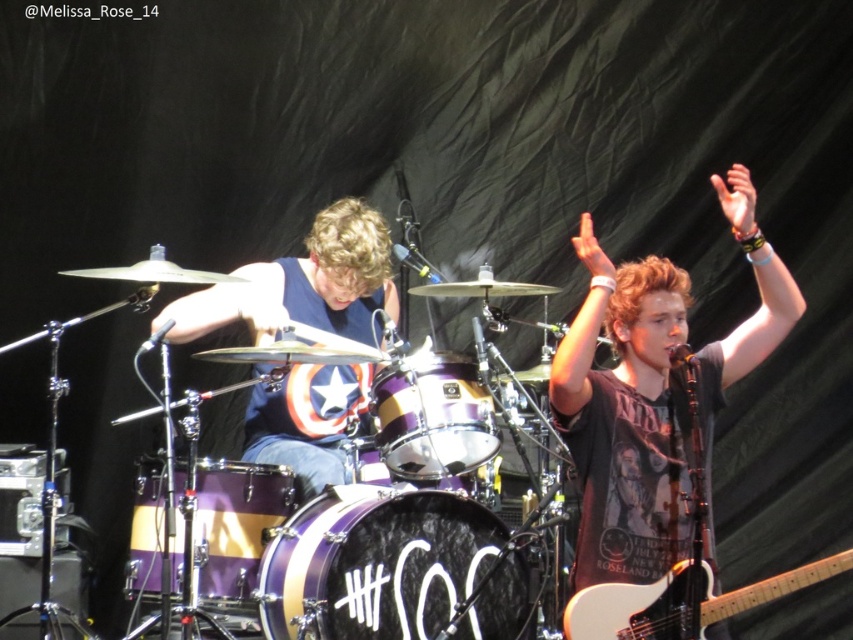
Question: Does blue fabric shirt at center appear on the left side of white glossy electric guitar at lower right?

Choices:
 (A) yes
 (B) no

Answer: (A)

Question: Which point appears farthest from the camera in this image?

Choices:
 (A) (364, 456)
 (B) (660, 586)

Answer: (A)

Question: Can you confirm if purple glossy drum at center is positioned above purple metallic drum at center?

Choices:
 (A) yes
 (B) no

Answer: (B)

Question: Is purple glossy drum at center thinner than white glossy electric guitar at lower right?

Choices:
 (A) no
 (B) yes

Answer: (B)

Question: Which object appears closest to the camera in this image?

Choices:
 (A) shiny purple drum set at center
 (B) purple metallic drum at center

Answer: (A)

Question: Which point is closer to the camera?

Choices:
 (A) white glossy electric guitar at lower right
 (B) black cotton t-shirt at center
 (C) shiny purple drum set at center
 (D) purple metallic drum at center

Answer: (A)